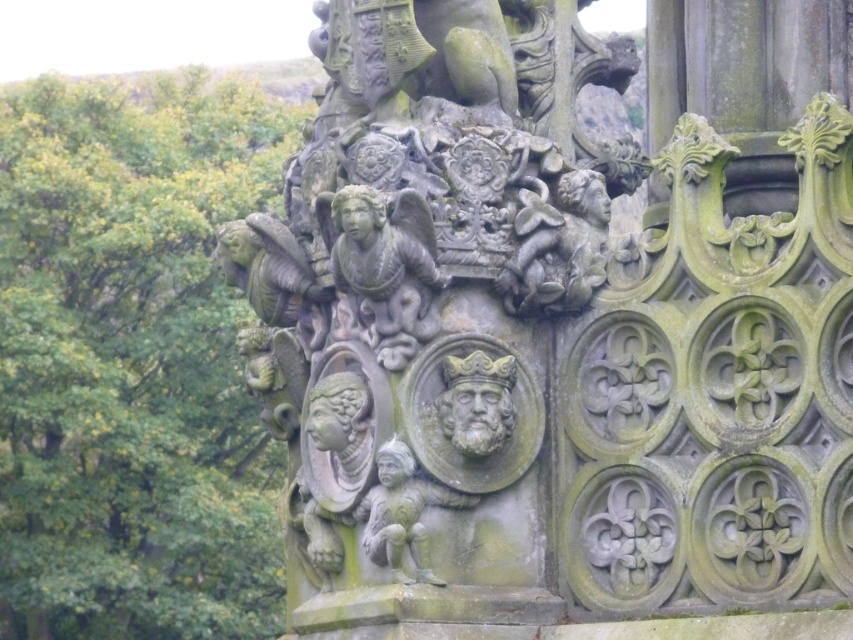
Question: Is the position of green mossy stone tree at upper left less distant than that of gray stone figure at center?

Choices:
 (A) no
 (B) yes

Answer: (A)

Question: Can you confirm if green mossy stone tree at upper left is smaller than gray stone figure at center?

Choices:
 (A) no
 (B) yes

Answer: (A)

Question: Which object appears farthest from the camera in this image?

Choices:
 (A) gray stone figure at center
 (B) green mossy stone tree at upper left

Answer: (B)

Question: Is green mossy stone tree at upper left to the left of gray stone figure at center from the viewer's perspective?

Choices:
 (A) yes
 (B) no

Answer: (A)